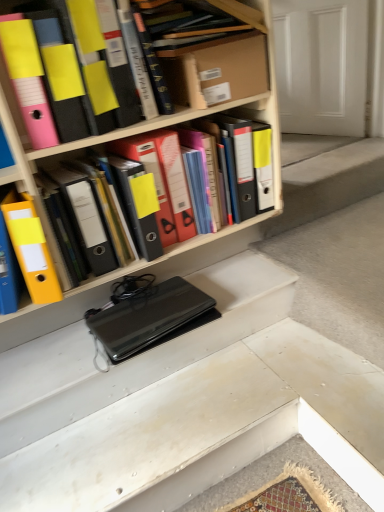
The height and width of the screenshot is (512, 384). What are the coordinates of `cardboard box at upper center` in the screenshot? It's located at (216, 70).

Identify the location of wooden book at upper center, which appears as the 1th book when viewed from the right. (188, 23).

In order to click on matte black binder at upper left, arranged as the first book when viewed from the left in this screenshot , I will do `click(219, 65)`.

Is hardcover book at upper center, the 2th book viewed from the right, taller than black matte laptop at center?

Correct, hardcover book at upper center, the 2th book viewed from the right, is much taller as black matte laptop at center.

Can you confirm if hardcover book at upper center, which is the second book from left to right, is positioned to the left of black matte laptop at center?

Yes, hardcover book at upper center, which is the second book from left to right, is to the left of black matte laptop at center.

Is hardcover book at upper center, which is the second book from left to right, beside black matte laptop at center?

There is a gap between hardcover book at upper center, which is the second book from left to right, and black matte laptop at center.

From a real-world perspective, who is located higher, hardcover book at upper center, which is the second book from left to right, or black matte laptop at center?

hardcover book at upper center, which is the second book from left to right.

Is matte black binder at upper left, arranged as the first book when viewed from the left, positioned beyond the bounds of yellow matte ring binder at center?

That's correct, matte black binder at upper left, arranged as the first book when viewed from the left, is outside of yellow matte ring binder at center.

How many degrees apart are the facing directions of matte black binder at upper left, arranged as the first book when viewed from the left, and yellow matte ring binder at center?

The angle between the facing direction of matte black binder at upper left, arranged as the first book when viewed from the left, and the facing direction of yellow matte ring binder at center is 0.000775 degrees.

Would you consider matte black binder at upper left, which is the 3th book from right to left, to be distant from yellow matte ring binder at center?

No, matte black binder at upper left, which is the 3th book from right to left, is in close proximity to yellow matte ring binder at center.

Considering the relative positions of matte black binder at upper left, which is the 3th book from right to left, and yellow matte ring binder at center in the image provided, is matte black binder at upper left, which is the 3th book from right to left, behind yellow matte ring binder at center?

No, it is not.

Looking at this image, is yellow matte ring binder at center in front of or behind white matte door at upper right in the image?

Visually, yellow matte ring binder at center is located in front of white matte door at upper right.

Does yellow matte ring binder at center appear on the right side of white matte door at upper right?

In fact, yellow matte ring binder at center is to the left of white matte door at upper right.

From a real-world perspective, is yellow matte ring binder at center above or below white matte door at upper right?

yellow matte ring binder at center is below white matte door at upper right.

From the image's perspective, which object appears higher, yellow matte ring binder at center or white matte door at upper right?

white matte door at upper right.

Is point (146, 73) closer or farther from the camera than point (239, 97)?

Point (146, 73).

Could you tell me if hardcover book at upper center, the 2th book viewed from the right, is turned towards cardboard box at upper center?

No, hardcover book at upper center, the 2th book viewed from the right, is not aimed at cardboard box at upper center.

From the picture: Does hardcover book at upper center, the 2th book viewed from the right, lie behind cardboard box at upper center?

No, hardcover book at upper center, the 2th book viewed from the right, is closer to the viewer.

Considering the relative sizes of hardcover book at upper center, which is the second book from left to right, and cardboard box at upper center in the image provided, is hardcover book at upper center, which is the second book from left to right, bigger than cardboard box at upper center?

Actually, hardcover book at upper center, which is the second book from left to right, might be smaller than cardboard box at upper center.

Which of these two, white matte door at upper right or cardboard box at upper center, stands taller?

white matte door at upper right.

Considering the sizes of white matte door at upper right and cardboard box at upper center in the image, is white matte door at upper right bigger or smaller than cardboard box at upper center?

In the image, white matte door at upper right appears to be larger than cardboard box at upper center.

Are white matte door at upper right and cardboard box at upper center far apart?

Yes, white matte door at upper right and cardboard box at upper center are quite far apart.

Which object is closer to the camera, white matte door at upper right or cardboard box at upper center?

Positioned in front is cardboard box at upper center.

Considering the points (3, 170) and (136, 79), which point is in front, point (3, 170) or point (136, 79)?

Positioned in front is point (3, 170).

At what (x,y) coordinates should I click in order to perform the action: click on the 2nd book above when counting from the yellow matte ring binder at center (from the image's perspective). Please return your answer as a coordinate pair (x, y). This screenshot has width=384, height=512. Looking at the image, I should click on (136, 60).

Can you confirm if yellow matte ring binder at center is smaller than hardcover book at upper center, the 2th book viewed from the right?

Actually, yellow matte ring binder at center might be larger than hardcover book at upper center, the 2th book viewed from the right.

Between yellow matte ring binder at center and hardcover book at upper center, the 2th book viewed from the right, which one appears on the right side from the viewer's perspective?

yellow matte ring binder at center.

Considering the points (169, 313) and (174, 61), which point is behind, point (169, 313) or point (174, 61)?

Point (169, 313)

Considering the relative sizes of black matte laptop at center and matte black binder at upper left, which is the 3th book from right to left, in the image provided, is black matte laptop at center taller than matte black binder at upper left, which is the 3th book from right to left,?

Incorrect, the height of black matte laptop at center is not larger of that of matte black binder at upper left, which is the 3th book from right to left.

Does black matte laptop at center turn towards matte black binder at upper left, which is the 3th book from right to left?

No, black matte laptop at center is not facing towards matte black binder at upper left, which is the 3th book from right to left.

Consider the image. Are black matte laptop at center and matte black binder at upper left, arranged as the first book when viewed from the left, making contact?

No.

You are a GUI agent. You are given a task and a screenshot of the screen. Output one action in this format:
    pyautogui.click(x=<x>, y=<y>)
    Task: Click on the book that is the 1st object located in front of the black matte laptop at center
    The height and width of the screenshot is (512, 384).
    Given the screenshot: What is the action you would take?
    pyautogui.click(x=136, y=60)

The width and height of the screenshot is (384, 512). Find the location of `the 2nd book above the yellow matte ring binder at center (from a real-world perspective)`. the 2nd book above the yellow matte ring binder at center (from a real-world perspective) is located at coordinates (219, 65).

Consider the image. From the image, which object appears to be farther from white matte door at upper right, hardcover book at upper center, which is the second book from left to right, or yellow matte ring binder at center?

hardcover book at upper center, which is the second book from left to right.

Estimate the real-world distances between objects in this image. Which object is further from hardcover book at upper center, which is the second book from left to right, white matte door at upper right or cardboard box at upper center?

Based on the image, white matte door at upper right appears to be further to hardcover book at upper center, which is the second book from left to right.

Looking at the image, which one is located further to white matte door at upper right, cardboard box at upper center or wooden book at upper center, the third book positioned from the left?

The object further to white matte door at upper right is wooden book at upper center, the third book positioned from the left.

Which object lies further to the anchor point matte black binder at upper left, arranged as the first book when viewed from the left, white matte door at upper right or yellow matte ring binder at center?

white matte door at upper right lies further to matte black binder at upper left, arranged as the first book when viewed from the left, than the other object.

Looking at the image, which one is located closer to cardboard box at upper center, wooden book at upper center, the third book positioned from the left, or yellow matte ring binder at center?

wooden book at upper center, the third book positioned from the left, lies closer to cardboard box at upper center than the other object.

Considering their positions, is black matte laptop at center positioned further to matte black binder at upper left, arranged as the first book when viewed from the left, than yellow matte ring binder at center?

black matte laptop at center is further to matte black binder at upper left, arranged as the first book when viewed from the left.

Estimate the real-world distances between objects in this image. Which object is further from black matte laptop at center, yellow matte ring binder at center or white matte door at upper right?

white matte door at upper right lies further to black matte laptop at center than the other object.

Estimate the real-world distances between objects in this image. Which object is closer to hardcover book at upper center, the 2th book viewed from the right, wooden book at upper center, which appears as the 1th book when viewed from the right, or yellow matte ring binder at center?

wooden book at upper center, which appears as the 1th book when viewed from the right, is closer to hardcover book at upper center, the 2th book viewed from the right.

Where is `bookcase between hardcover book at upper center, the 2th book viewed from the right, and white matte door at upper right`? bookcase between hardcover book at upper center, the 2th book viewed from the right, and white matte door at upper right is located at coordinates (137, 133).

You are a GUI agent. You are given a task and a screenshot of the screen. Output one action in this format:
    pyautogui.click(x=<x>, y=<y>)
    Task: Click on the book that lies between hardcover book at upper center, which is the second book from left to right, and black matte laptop at center from top to bottom
    Image resolution: width=384 pixels, height=512 pixels.
    Given the screenshot: What is the action you would take?
    pyautogui.click(x=219, y=65)

The width and height of the screenshot is (384, 512). Identify the location of bookcase between white matte door at upper right and black matte laptop at center vertically. (137, 133).

Identify the location of bookcase positioned between wooden book at upper center, which appears as the 1th book when viewed from the right, and white matte door at upper right from near to far. (137, 133).